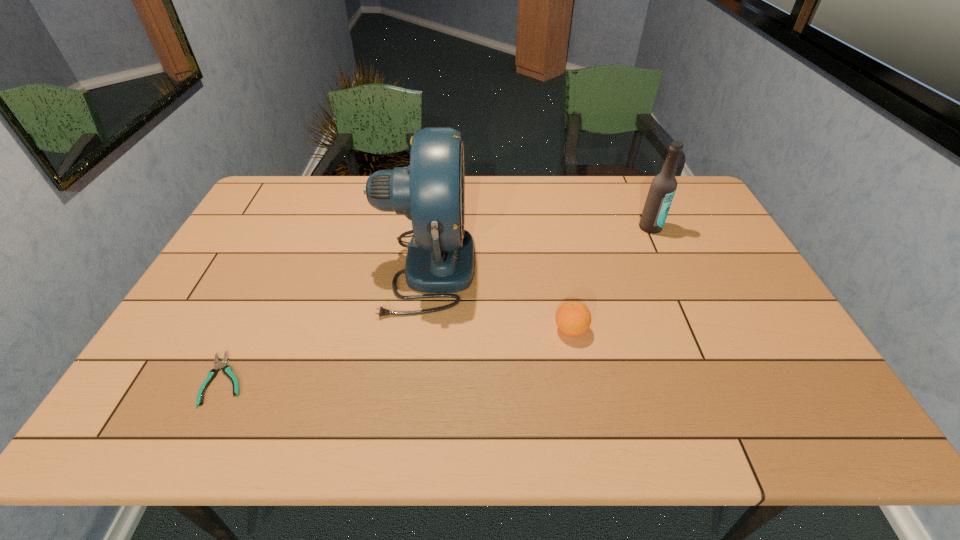
The image size is (960, 540). I want to click on the tallest object, so click(x=431, y=191).

The height and width of the screenshot is (540, 960). I want to click on the second object from left to right, so click(x=431, y=191).

Locate an element on the screen. This screenshot has height=540, width=960. the second tallest object is located at coordinates (663, 187).

You are a GUI agent. You are given a task and a screenshot of the screen. Output one action in this format:
    pyautogui.click(x=<x>, y=<y>)
    Task: Click on the rightmost object
    The height and width of the screenshot is (540, 960).
    Given the screenshot: What is the action you would take?
    pyautogui.click(x=663, y=187)

The height and width of the screenshot is (540, 960). I want to click on the third object from left to right, so click(x=573, y=318).

Identify the location of the second shortest object. The height and width of the screenshot is (540, 960). (x=573, y=318).

Locate an element on the screen. The image size is (960, 540). the shortest object is located at coordinates (226, 369).

You are a GUI agent. You are given a task and a screenshot of the screen. Output one action in this format:
    pyautogui.click(x=<x>, y=<y>)
    Task: Click on the nearest object
    
    Given the screenshot: What is the action you would take?
    pyautogui.click(x=226, y=369)

Identify the location of vacant area situated 0.240m in front of the second object from left to right to blow air. (556, 268).

Where is `free spot located on the label of the rightmost object`? Image resolution: width=960 pixels, height=540 pixels. free spot located on the label of the rightmost object is located at coordinates (682, 296).